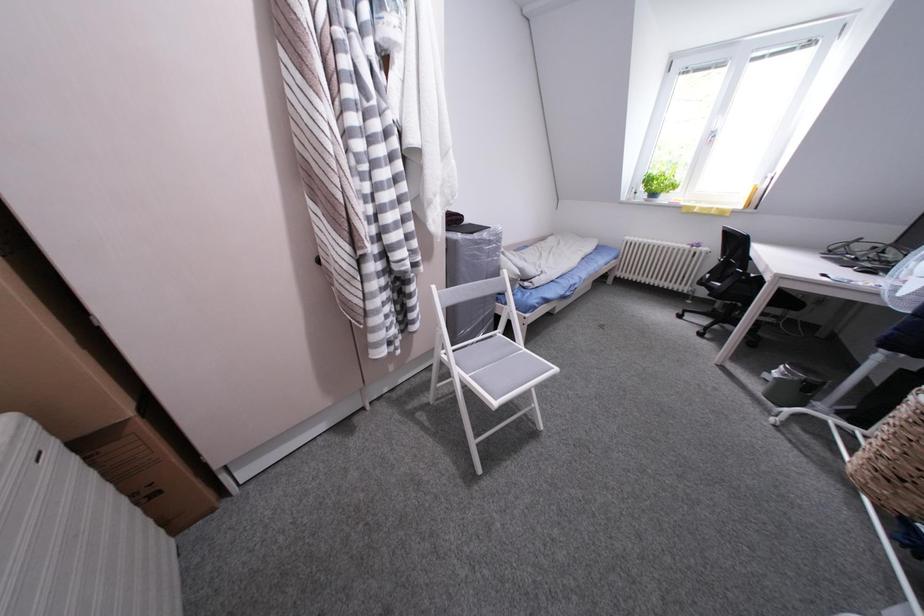
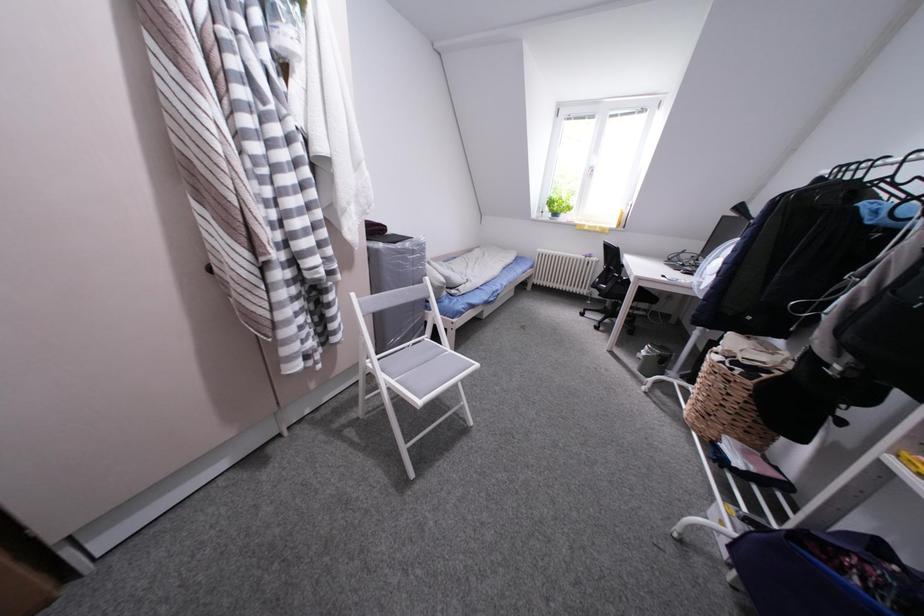
Question: How did the camera likely rotate?

Choices:
 (A) Left
 (B) Right
 (C) Up
 (D) Down

Answer: (B)